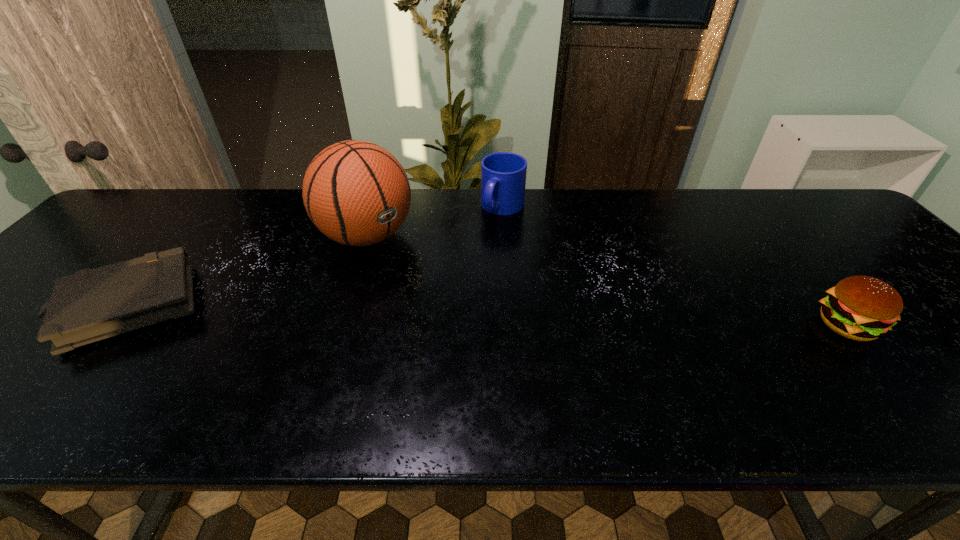
Locate an element on the screen. The width and height of the screenshot is (960, 540). the leftmost object is located at coordinates (93, 304).

This screenshot has width=960, height=540. I want to click on Bible, so click(93, 304).

Locate an element on the screen. The image size is (960, 540). hamburger is located at coordinates (862, 308).

Find the location of `the rightmost object`. the rightmost object is located at coordinates (862, 308).

Locate an element on the screen. Image resolution: width=960 pixels, height=540 pixels. mug is located at coordinates pos(503,174).

You are a GUI agent. You are given a task and a screenshot of the screen. Output one action in this format:
    pyautogui.click(x=<x>, y=<y>)
    Task: Click on the basketball
    The width and height of the screenshot is (960, 540).
    Given the screenshot: What is the action you would take?
    (355, 192)

The width and height of the screenshot is (960, 540). What are the coordinates of `the second object from left to right` in the screenshot? It's located at (355, 192).

Image resolution: width=960 pixels, height=540 pixels. What are the coordinates of `vacant space located on the back of the Bible` in the screenshot? It's located at (188, 234).

I want to click on vacant region located on the right of the second shortest object, so click(x=944, y=326).

What are the coordinates of `vacant region located 0.310m on the side with the handle of the second object from right to left` in the screenshot? It's located at (443, 289).